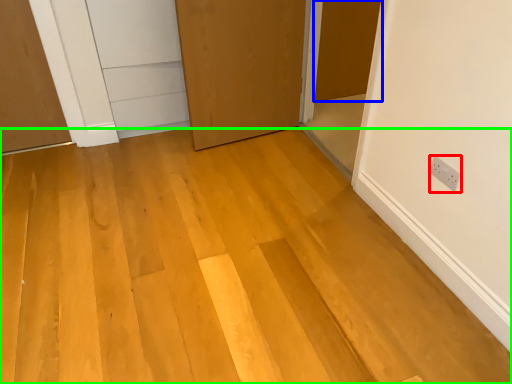
Question: Which object is positioned closest to electric outlet (highlighted by a red box)? Select from door (highlighted by a blue box) and plywood (highlighted by a green box).

Choices:
 (A) door
 (B) plywood

Answer: (B)